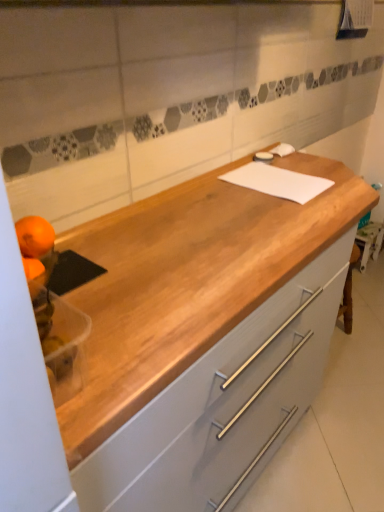
In order to click on free space on the front side of white matte cutting board at center in this screenshot , I will do `click(281, 209)`.